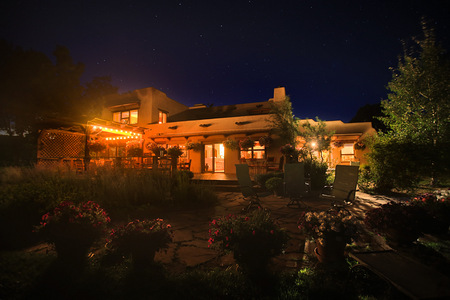
Image resolution: width=450 pixels, height=300 pixels. In order to click on chair in this screenshot , I will do `click(341, 185)`.